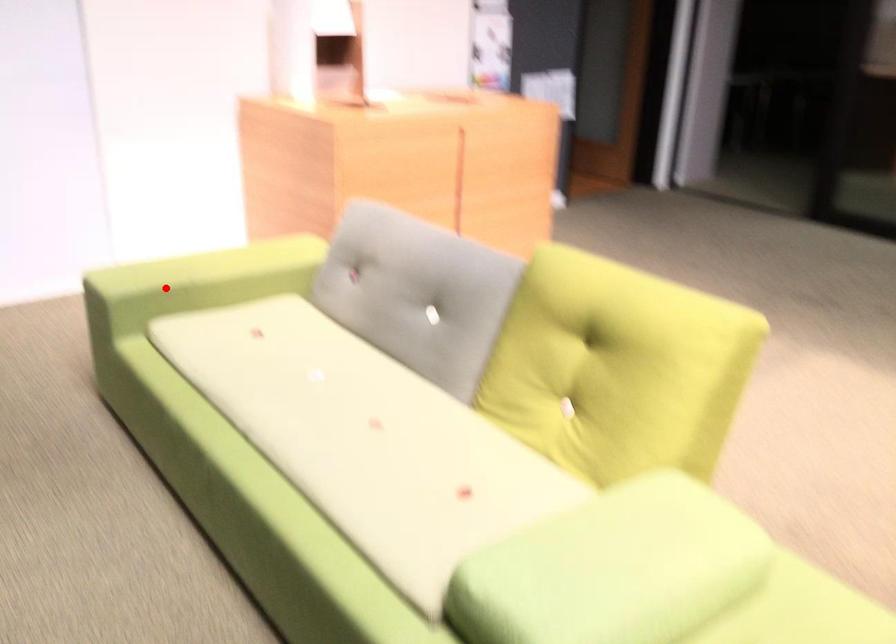
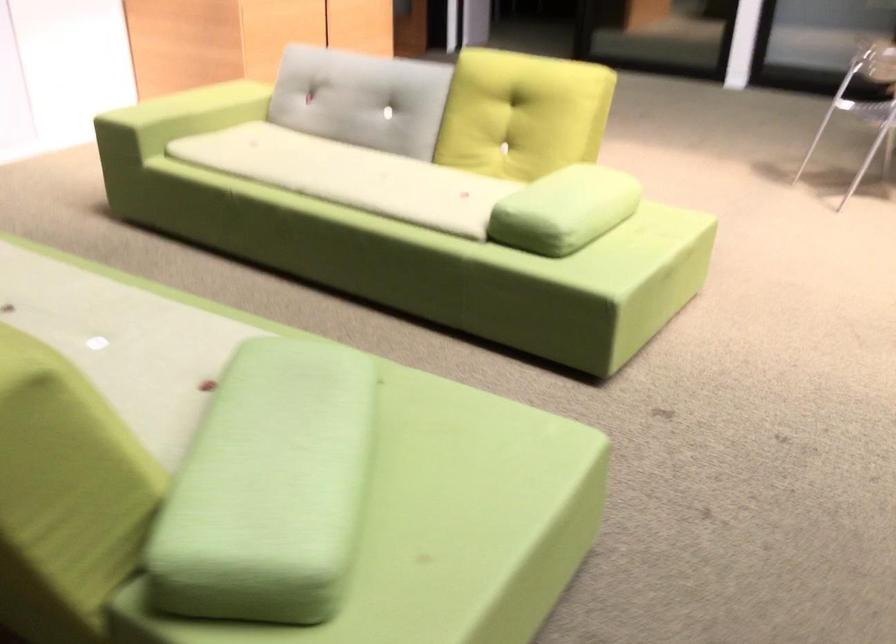
Locate, in the second image, the point that corresponds to the highlighted location in the first image.

(178, 117)